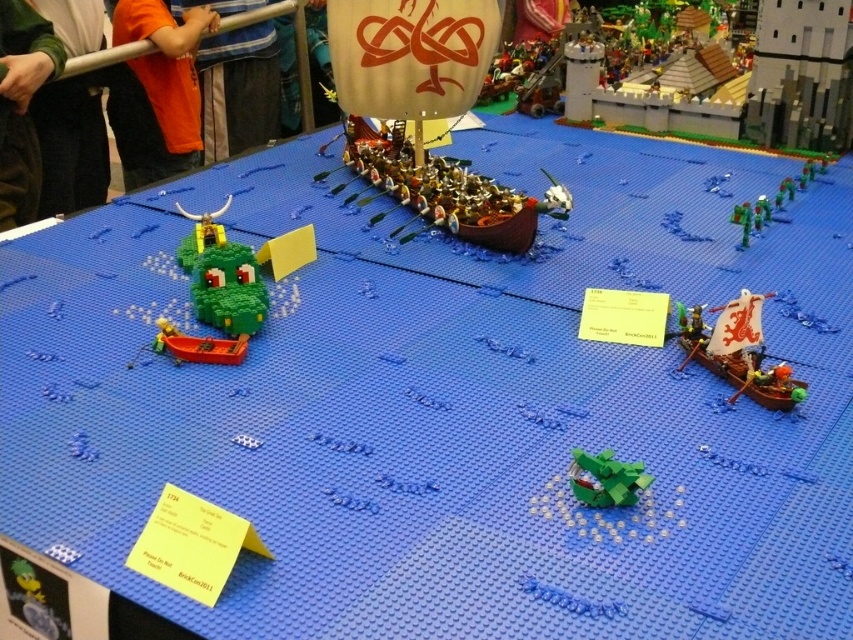
Is green fuzzy sweater at upper left smaller than green matte dragon at lower center?

No.

What do you see at coordinates (21, 106) in the screenshot? Image resolution: width=853 pixels, height=640 pixels. I see `green fuzzy sweater at upper left` at bounding box center [21, 106].

You are a GUI agent. You are given a task and a screenshot of the screen. Output one action in this format:
    pyautogui.click(x=<x>, y=<y>)
    Task: Click on the green fuzzy sweater at upper left
    The width and height of the screenshot is (853, 640).
    Given the screenshot: What is the action you would take?
    pyautogui.click(x=21, y=106)

Is point (94, 182) in front of point (231, 131)?

Yes, point (94, 182) is closer to viewer.

In the scene shown: Between green fabric shirt at upper left and orange shirt at upper left, which one appears on the left side from the viewer's perspective?

Positioned to the left is green fabric shirt at upper left.

I want to click on green fabric shirt at upper left, so click(x=70, y=145).

You are a GUI agent. You are given a task and a screenshot of the screen. Output one action in this format:
    pyautogui.click(x=<x>, y=<y>)
    Task: Click on the green fabric shirt at upper left
    This screenshot has width=853, height=640.
    Given the screenshot: What is the action you would take?
    pyautogui.click(x=70, y=145)

Is point (134, 168) positioned behind point (746, 294)?

Yes, it is behind point (746, 294).

Is point (128, 99) positioned after point (749, 380)?

Yes, it is.

Identify the location of orange t-shirt at upper left. This screenshot has height=640, width=853. (155, 92).